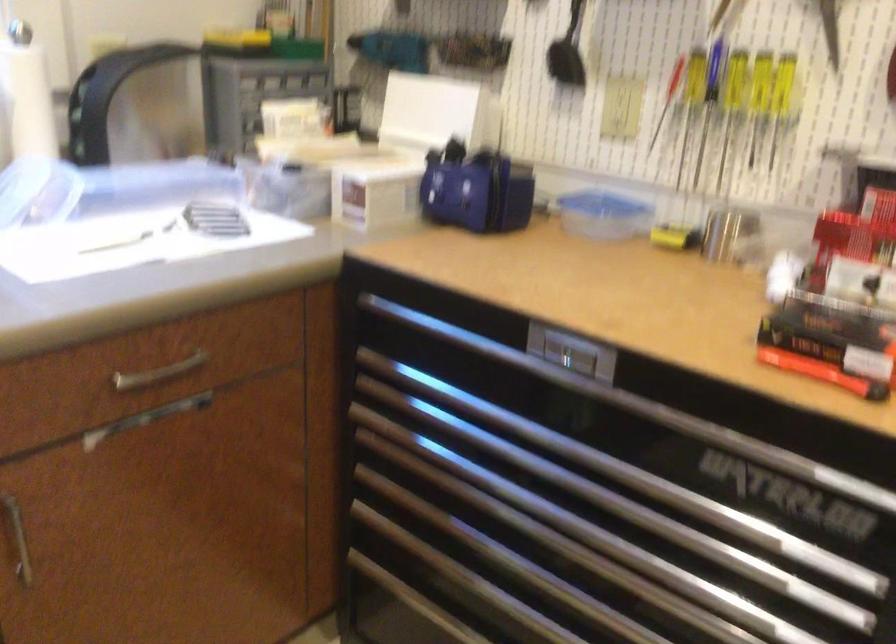
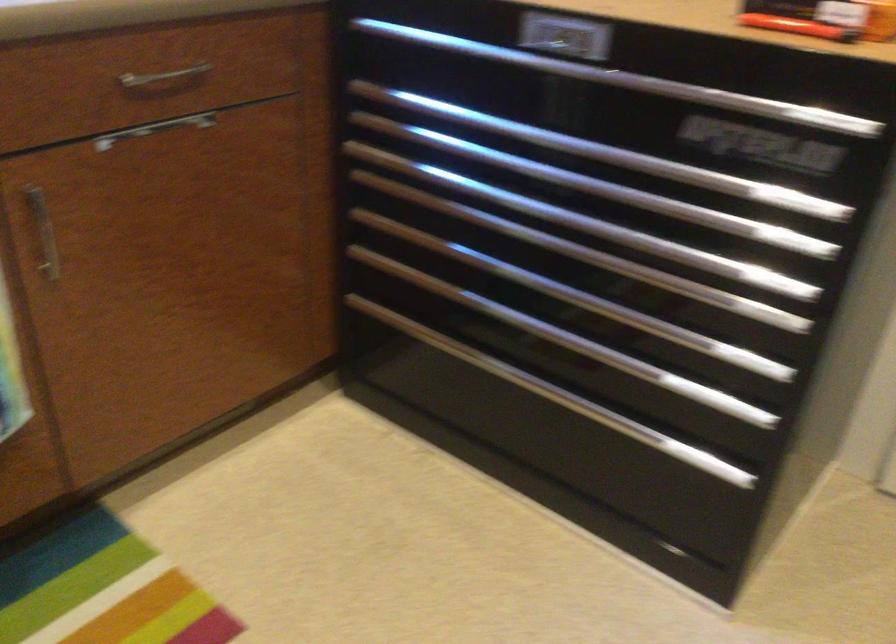
Where in the second image is the point corresponding to (684,420) from the first image?

(668, 88)